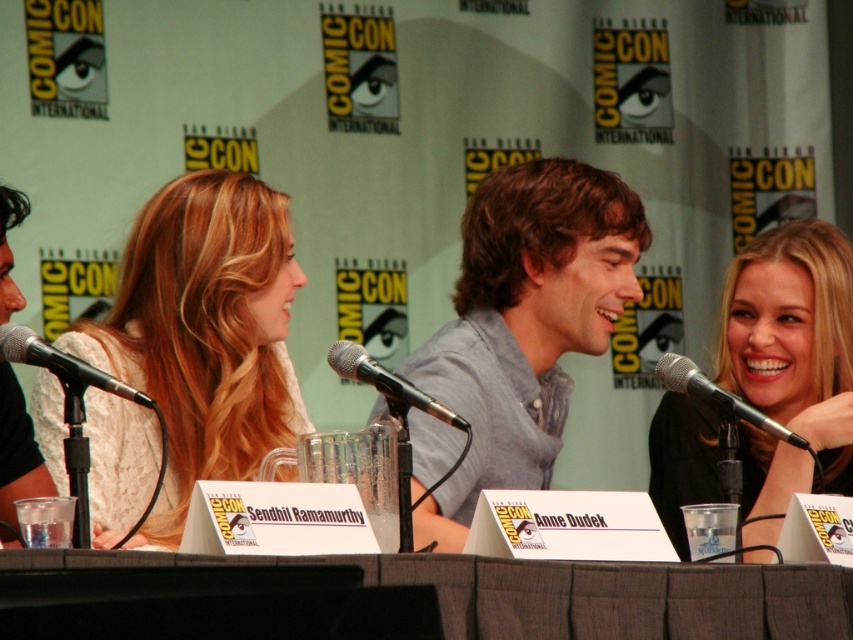
Who is positioned more to the right, black fabric table at center or black metallic microphone at left?

Positioned to the right is black fabric table at center.

Does black fabric table at center lie in front of black metallic microphone at left?

Yes, it is.

Locate an element on the screen. black fabric table at center is located at coordinates (409, 596).

Where is `black fabric table at center`? This screenshot has width=853, height=640. black fabric table at center is located at coordinates (409, 596).

Which is below, blonde hair at upper right or black metallic microphone at upper right?

blonde hair at upper right

Is point (782, 236) farther from viewer compared to point (699, 380)?

Yes, point (782, 236) is farther from viewer.

Is point (845, 493) behind point (735, 410)?

Yes, point (845, 493) is behind point (735, 410).

At what (x,y) coordinates should I click in order to perform the action: click on blonde hair at upper right. Please return your answer as a coordinate pair (x, y). Looking at the image, I should click on (793, 337).

Is point (148, 404) in front of point (741, 412)?

Yes, it is.

Between black metallic microphone at left and black metallic microphone at upper right, which one is positioned higher?

black metallic microphone at left is higher up.

Where is `black metallic microphone at left`? black metallic microphone at left is located at coordinates (61, 362).

Image resolution: width=853 pixels, height=640 pixels. In order to click on black metallic microphone at left in this screenshot , I will do `click(61, 362)`.